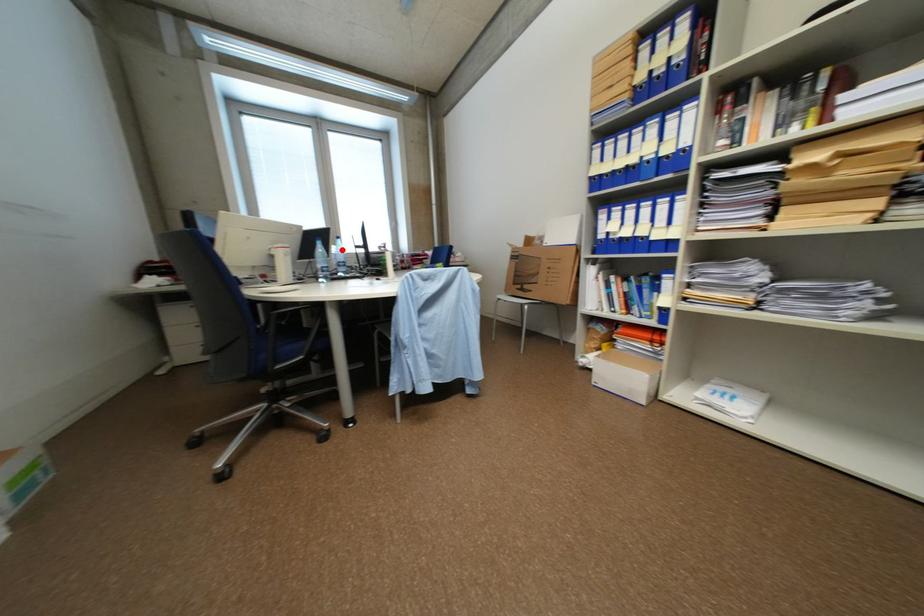
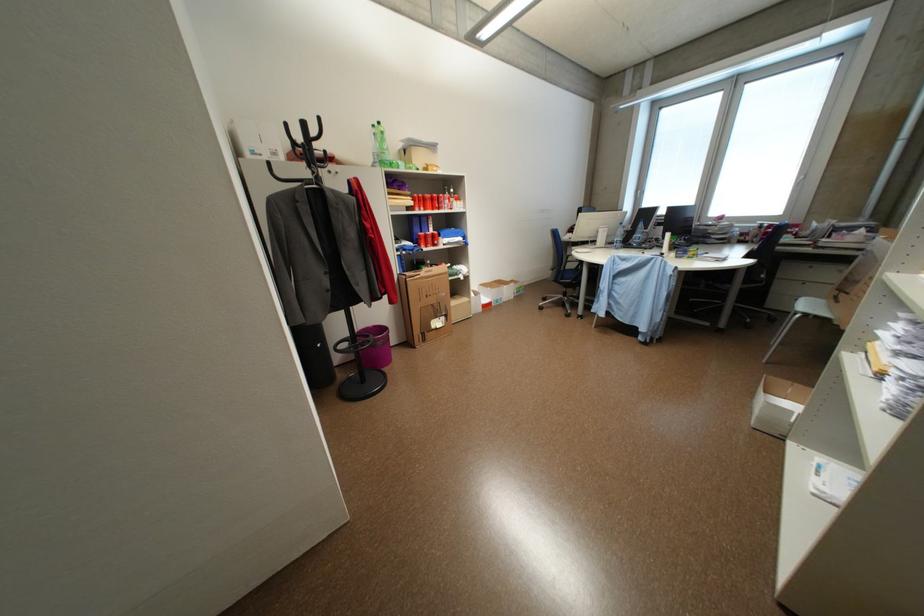
Question: I am providing you with two images of the same scene from different viewpoints. A red point is marked on the first image. Is the red point's position out of view in image 2?

Choices:
 (A) Yes
 (B) No

Answer: (A)